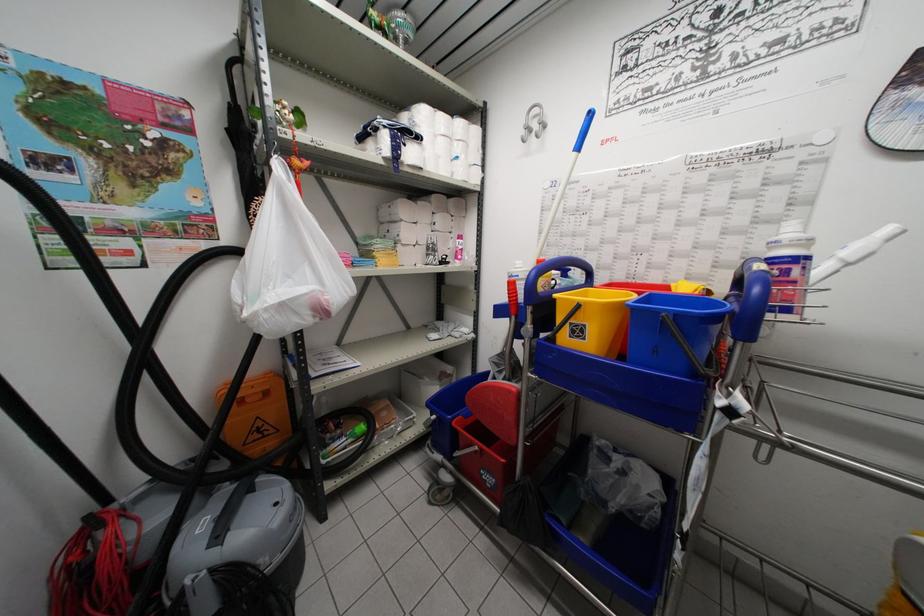
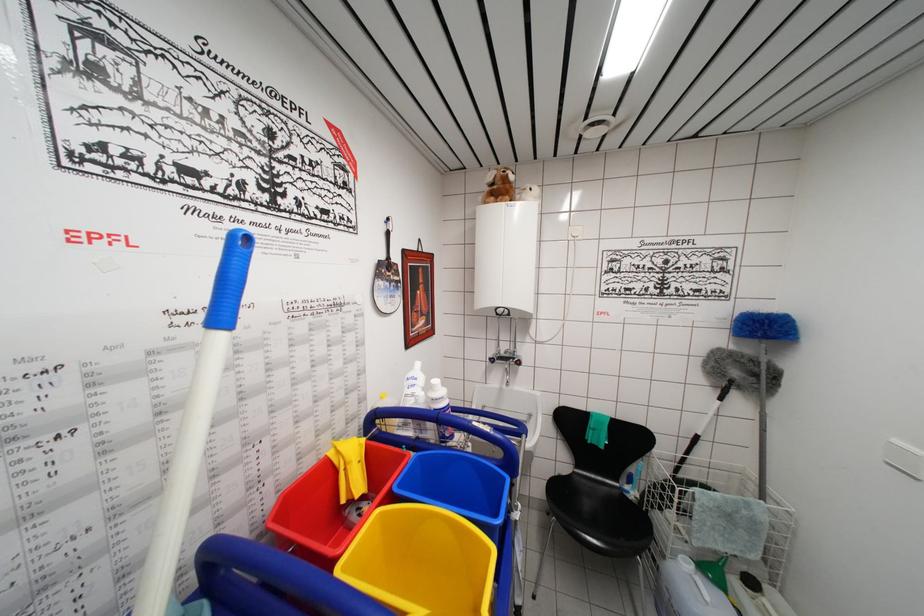
Question: The images are taken continuously from a first-person perspective. In which direction is your viewpoint rotating?

Choices:
 (A) Left
 (B) Right
 (C) Up
 (D) Down

Answer: (B)